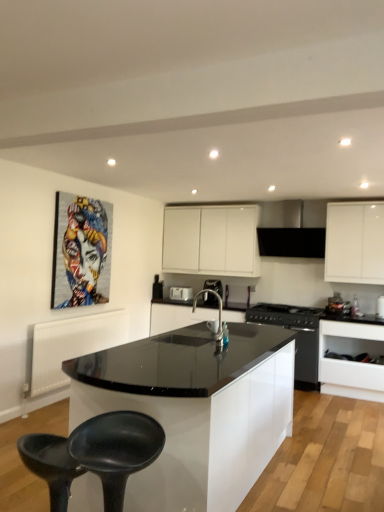
Question: From a real-world perspective, is satin nickel faucet at center located beneath white glossy drawer at lower right, the first cabinetry ordered from the bottom?

Choices:
 (A) yes
 (B) no

Answer: (B)

Question: Could you tell me if satin nickel faucet at center is facing white glossy drawer at lower right, the first cabinetry ordered from the bottom?

Choices:
 (A) no
 (B) yes

Answer: (A)

Question: Is satin nickel faucet at center shorter than white glossy drawer at lower right, the third cabinetry from the top?

Choices:
 (A) no
 (B) yes

Answer: (B)

Question: Does satin nickel faucet at center come in front of white glossy drawer at lower right, the first cabinetry ordered from the bottom?

Choices:
 (A) no
 (B) yes

Answer: (B)

Question: Is satin nickel faucet at center at the right side of white glossy drawer at lower right, the third cabinetry from the top?

Choices:
 (A) no
 (B) yes

Answer: (A)

Question: From the image's perspective, is white glossy drawer at lower right, the first cabinetry ordered from the bottom, positioned above or below white glossy cabinet at upper center, positioned as the third cabinetry in bottom-to-top order?

Choices:
 (A) above
 (B) below

Answer: (B)

Question: Would you say white glossy drawer at lower right, the first cabinetry ordered from the bottom, is inside or outside white glossy cabinet at upper center, positioned as the third cabinetry in bottom-to-top order?

Choices:
 (A) outside
 (B) inside

Answer: (A)

Question: Considering the positions of white glossy drawer at lower right, the first cabinetry ordered from the bottom, and white glossy cabinet at upper center, which appears as the first cabinetry when viewed from the top, in the image, is white glossy drawer at lower right, the first cabinetry ordered from the bottom, wider or thinner than white glossy cabinet at upper center, which appears as the first cabinetry when viewed from the top,?

Choices:
 (A) wide
 (B) thin

Answer: (A)

Question: Would you say white glossy drawer at lower right, the third cabinetry from the top, is to the left or to the right of white glossy cabinet at upper center, positioned as the third cabinetry in bottom-to-top order, in the picture?

Choices:
 (A) left
 (B) right

Answer: (B)

Question: From a real-world perspective, is black matte range hood at upper center, arranged as the 2th kitchen appliance when ordered from the bottom, positioned above or below black matte bar stool at lower left?

Choices:
 (A) below
 (B) above

Answer: (B)

Question: Is black matte range hood at upper center, which is the first kitchen appliance in top-to-bottom order, inside or outside of black matte bar stool at lower left?

Choices:
 (A) outside
 (B) inside

Answer: (A)

Question: Does point (314, 224) appear closer or farther from the camera than point (57, 439)?

Choices:
 (A) farther
 (B) closer

Answer: (A)

Question: Considering their positions, is black matte range hood at upper center, arranged as the 2th kitchen appliance when ordered from the bottom, located in front of or behind black matte bar stool at lower left?

Choices:
 (A) front
 (B) behind

Answer: (B)

Question: Considering the positions of point (220, 309) and point (203, 293), is point (220, 309) closer or farther from the camera than point (203, 293)?

Choices:
 (A) farther
 (B) closer

Answer: (B)

Question: From a real-world perspective, is satin nickel faucet at center positioned above or below satin silver coffee machine at center?

Choices:
 (A) below
 (B) above

Answer: (B)